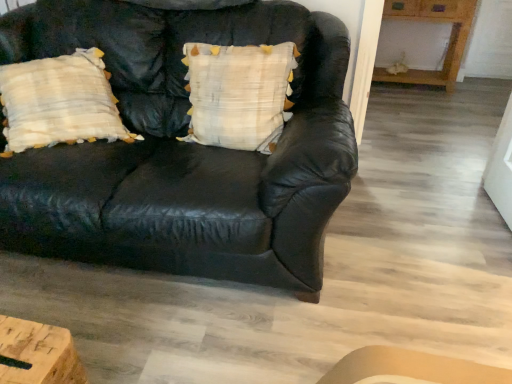
Question: Considering the relative sizes of white textured pillow at center and wooden table at upper right in the image provided, is white textured pillow at center smaller than wooden table at upper right?

Choices:
 (A) yes
 (B) no

Answer: (A)

Question: Is the position of white textured pillow at center more distant than that of wooden table at upper right?

Choices:
 (A) no
 (B) yes

Answer: (A)

Question: Is there a large distance between white textured pillow at center and wooden table at upper right?

Choices:
 (A) yes
 (B) no

Answer: (A)

Question: Could you tell me if white textured pillow at center is turned towards wooden table at upper right?

Choices:
 (A) yes
 (B) no

Answer: (B)

Question: Is white textured pillow at center at the left side of wooden table at upper right?

Choices:
 (A) no
 (B) yes

Answer: (B)

Question: Is white textured pillow at center next to wooden table at upper right?

Choices:
 (A) yes
 (B) no

Answer: (B)

Question: From the image's perspective, is white textured pillow at center located beneath black leather couch at center?

Choices:
 (A) yes
 (B) no

Answer: (B)

Question: From a real-world perspective, is white textured pillow at center on black leather couch at center?

Choices:
 (A) yes
 (B) no

Answer: (A)

Question: Can you confirm if white textured pillow at center is shorter than black leather couch at center?

Choices:
 (A) no
 (B) yes

Answer: (B)

Question: Is white textured pillow at center thinner than black leather couch at center?

Choices:
 (A) yes
 (B) no

Answer: (A)

Question: Does white textured pillow at center come behind black leather couch at center?

Choices:
 (A) yes
 (B) no

Answer: (A)

Question: Is white textured pillow at center at the right side of black leather couch at center?

Choices:
 (A) no
 (B) yes

Answer: (B)

Question: Is wooden table at upper right positioned beyond the bounds of black leather couch at center?

Choices:
 (A) yes
 (B) no

Answer: (A)